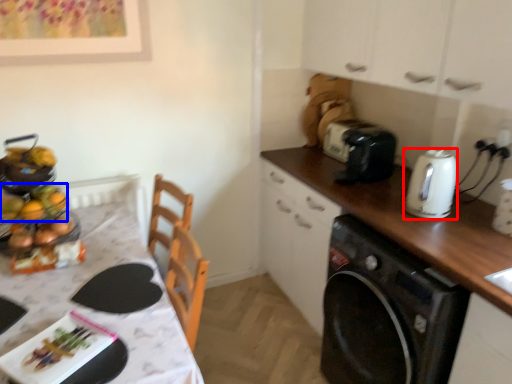
Question: Which point is further to the camera, kitchen appliance (highlighted by a red box) or food (highlighted by a blue box)?

Choices:
 (A) kitchen appliance
 (B) food

Answer: (A)